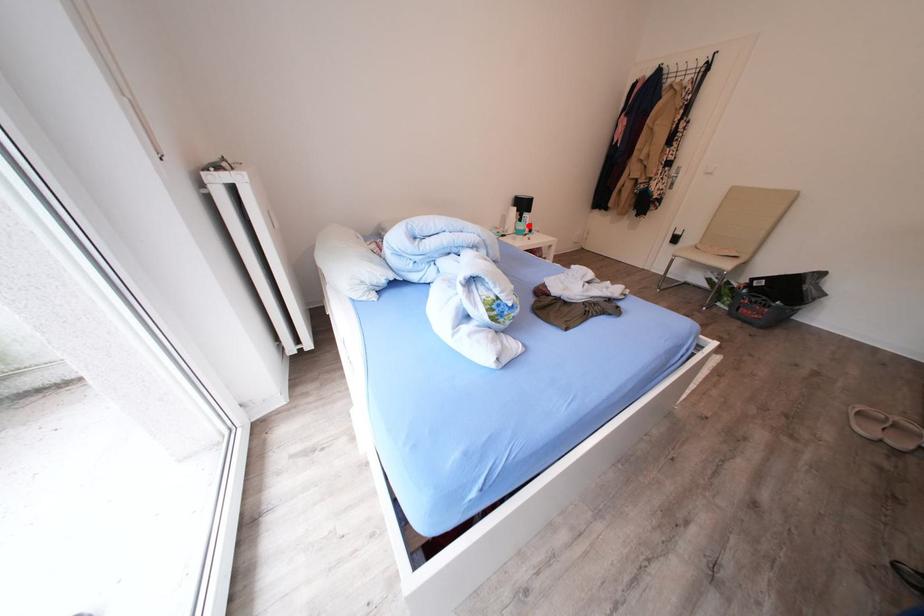
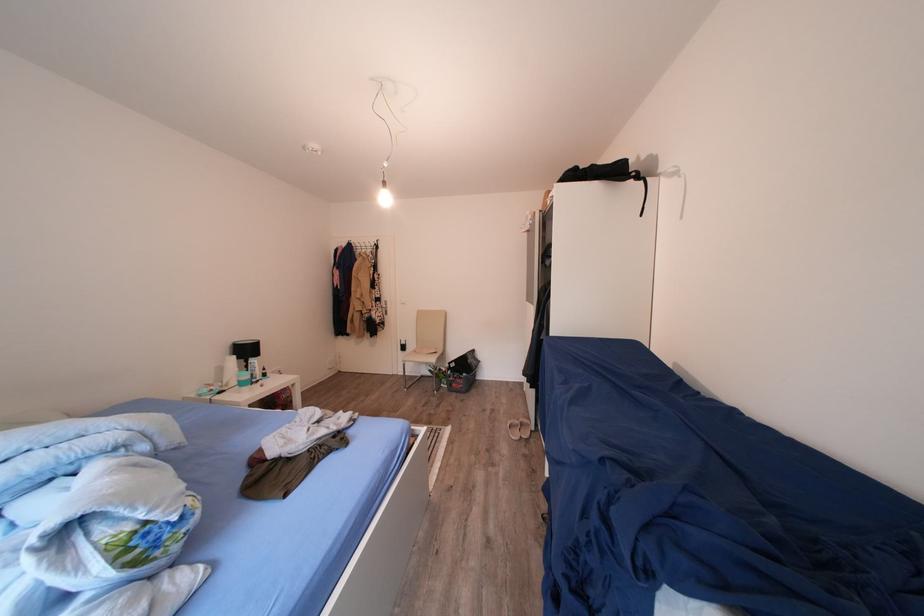
In the second image, find the point that corresponds to the highlighted location in the first image.

(256, 371)